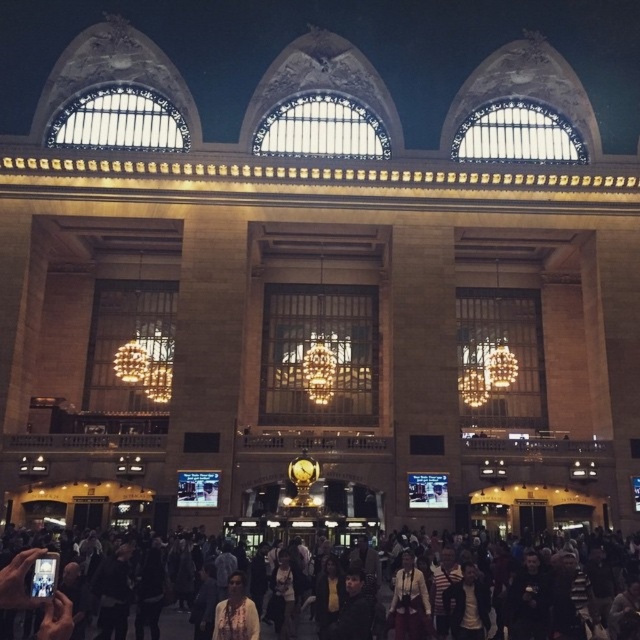
You are a customer in a busy store and you see both the multicolored clothing at lower center and the white textured shirt at center. Which item is positioned more to the right side of the store?

The multicolored clothing at lower center is positioned more to the right side of the store compared to the white textured shirt at center.

You are a customer in a clothing store and see the multicolored clothing at lower center and the white textured shirt at center. Which item would you need to bend down to pick up?

The multicolored clothing at lower center is bigger than the white textured shirt at center, so you would need to bend down to pick up the multicolored clothing at lower center.

You are standing in the grand historic building and want to find the multicolored clothing at lower center. According to the coordinates provided, where should you look?

The multicolored clothing at lower center is located at point (544, 604).